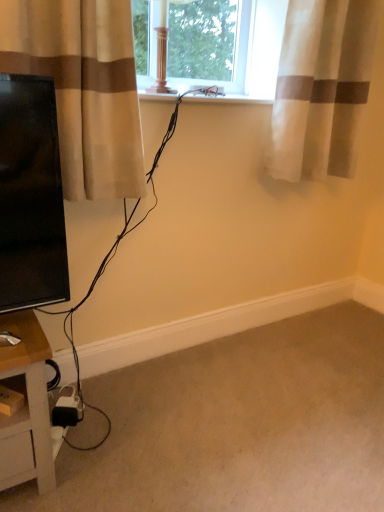
Question: Would you say sheer fabric curtain at upper right, arranged as the 1th curtain when viewed from the back, is to the left or to the right of beige fabric curtain at left, which is the first curtain in left-to-right order, in the picture?

Choices:
 (A) left
 (B) right

Answer: (B)

Question: Looking at their shapes, would you say sheer fabric curtain at upper right, the second curtain in the front-to-back sequence, is wider or thinner than beige fabric curtain at left, which is the first curtain in left-to-right order?

Choices:
 (A) thin
 (B) wide

Answer: (A)

Question: Which of these objects is positioned farthest from the beige carpet at lower right?

Choices:
 (A) beige fabric curtain at left, which is the first curtain in left-to-right order
 (B) sheer fabric curtain at upper right, arranged as the 1th curtain when viewed from the back

Answer: (B)

Question: Based on their relative distances, which object is farther from the beige carpet at lower right?

Choices:
 (A) sheer fabric curtain at upper right, positioned as the 1th curtain in right-to-left order
 (B) beige fabric curtain at left, which is the first curtain in left-to-right order

Answer: (A)